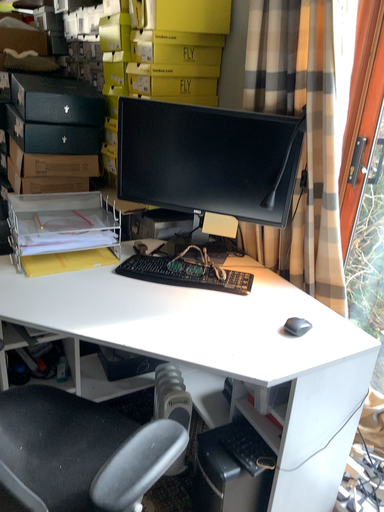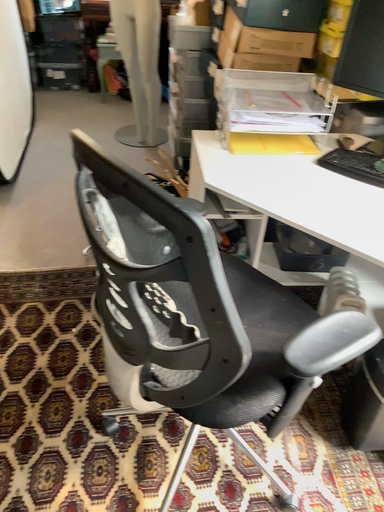
Question: Which way did the camera rotate in the video?

Choices:
 (A) rotated downward
 (B) rotated upward

Answer: (A)